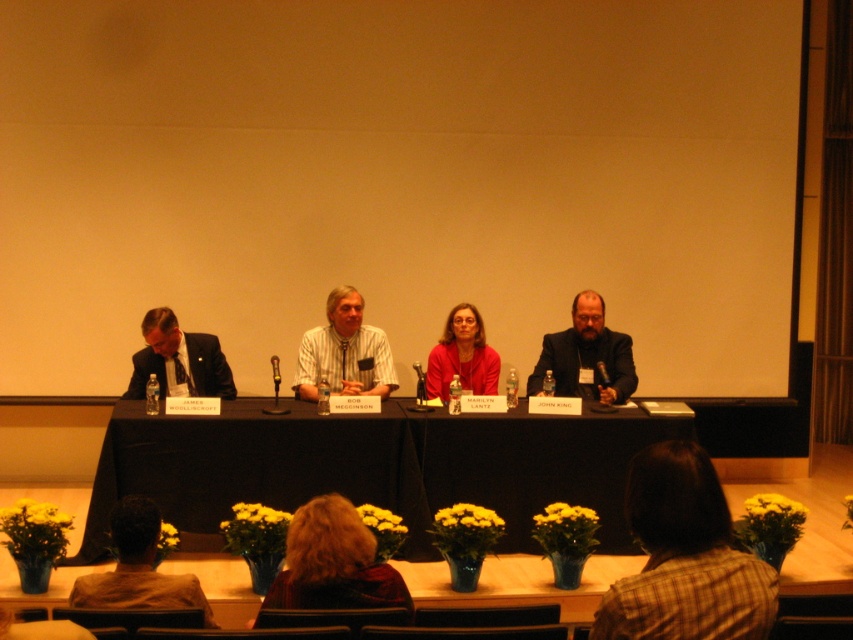
Question: Which point is farther from the camera taking this photo?

Choices:
 (A) (358, 330)
 (B) (125, 508)

Answer: (A)

Question: Does black fabric table at center have a smaller size compared to matte black suit at left?

Choices:
 (A) yes
 (B) no

Answer: (B)

Question: From the image, what is the correct spatial relationship of dark brown hair at lower center in relation to matte black suit at center?

Choices:
 (A) right
 (B) left

Answer: (B)

Question: Which point is farther to the camera?

Choices:
 (A) matte red blouse at center
 (B) matte black suit at left

Answer: (A)

Question: Which object is positioned closest to the brown leather jacket at lower left?

Choices:
 (A) dark brown hair at lower center
 (B) matte red blouse at center
 (C) matte black suit at left
 (D) matte black suit at center

Answer: (A)

Question: Can you confirm if dark brown hair at lower center is positioned to the left of striped cotton shirt at center?

Choices:
 (A) no
 (B) yes

Answer: (A)